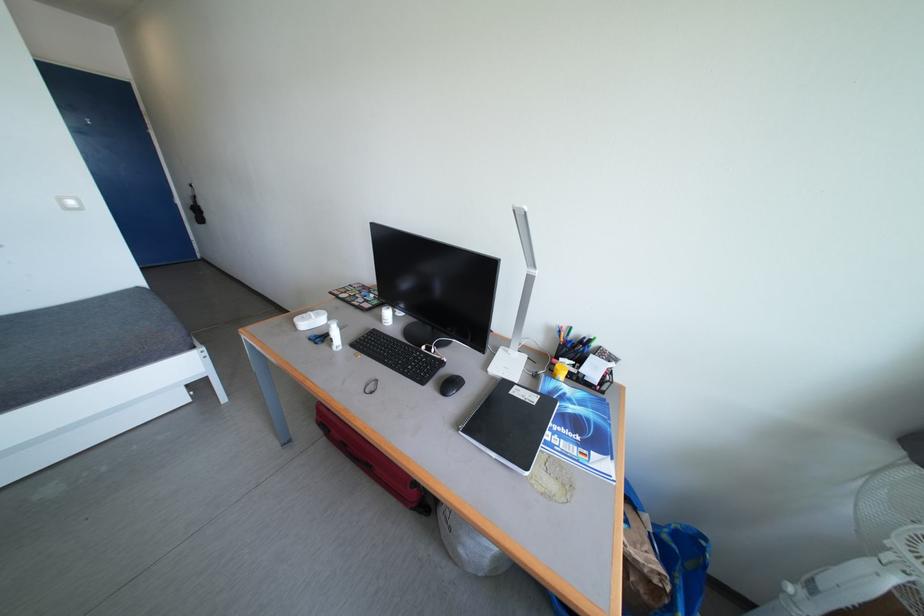
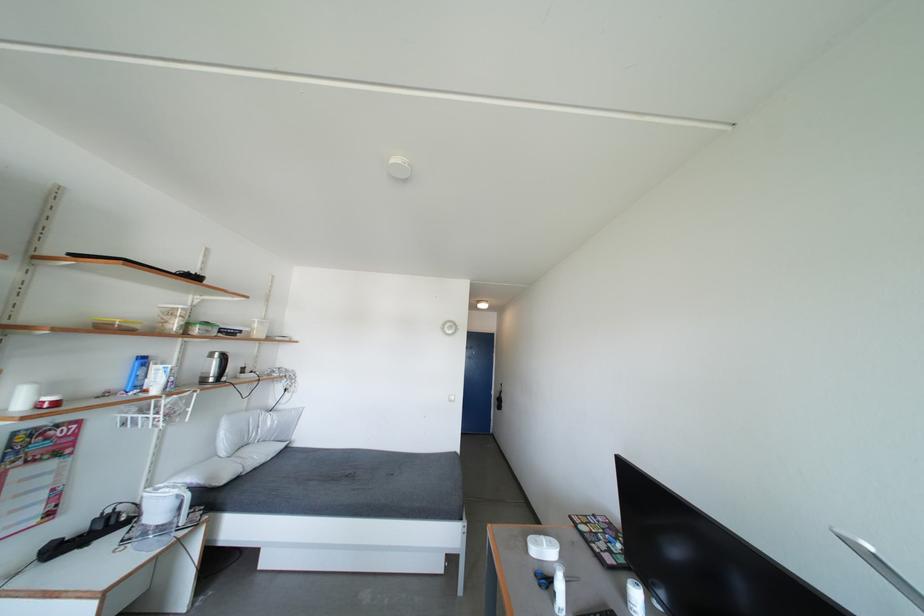
Where in the second image is the point corresponding to point (317, 318) from the first image?

(550, 544)